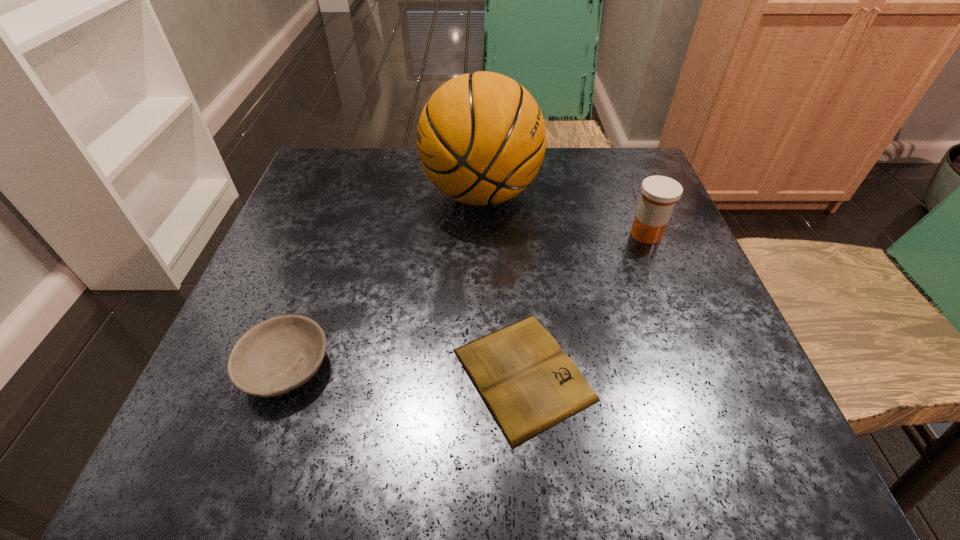
At what (x,y) coordinates should I click in order to perform the action: click on vacant space that satisfies the following two spatial constraints: 1. on the surface of the shortest object near the brand logo; 2. on the right side of the tallest object. Please return your answer as a coordinate pair (x, y). Looking at the image, I should click on pyautogui.click(x=482, y=374).

Where is `free spot that satisfies the following two spatial constraints: 1. on the front side of the shortest object; 2. on the right side of the second shortest object`? free spot that satisfies the following two spatial constraints: 1. on the front side of the shortest object; 2. on the right side of the second shortest object is located at coordinates (284, 374).

Locate an element on the screen. This screenshot has height=540, width=960. vacant area that satisfies the following two spatial constraints: 1. on the surface of the basketball near the brand logo; 2. on the back side of the book is located at coordinates (482, 374).

Image resolution: width=960 pixels, height=540 pixels. I want to click on vacant region that satisfies the following two spatial constraints: 1. on the label of the medicine; 2. on the front side of the leftmost object, so pyautogui.click(x=700, y=367).